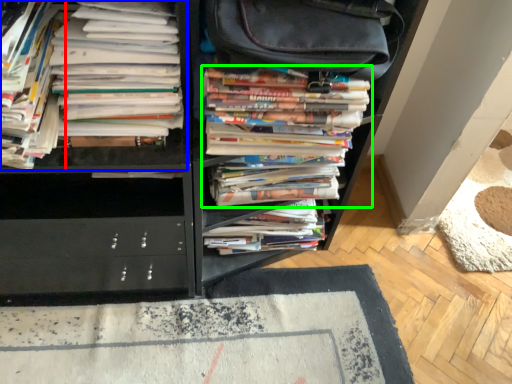
Question: Which is nearer to the book (highlighted by a red box)? book (highlighted by a blue box) or book (highlighted by a green box).

Choices:
 (A) book
 (B) book

Answer: (A)